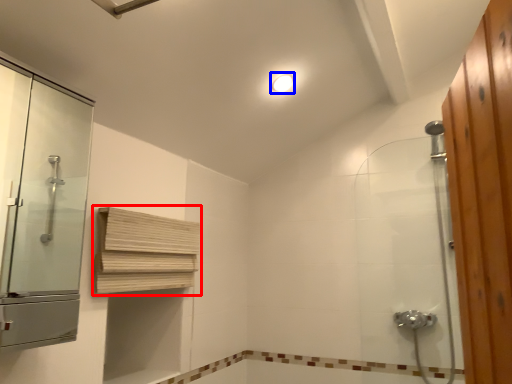
Question: Which point is further to the camera, shelf (highlighted by a red box) or light fixture (highlighted by a blue box)?

Choices:
 (A) shelf
 (B) light fixture

Answer: (B)